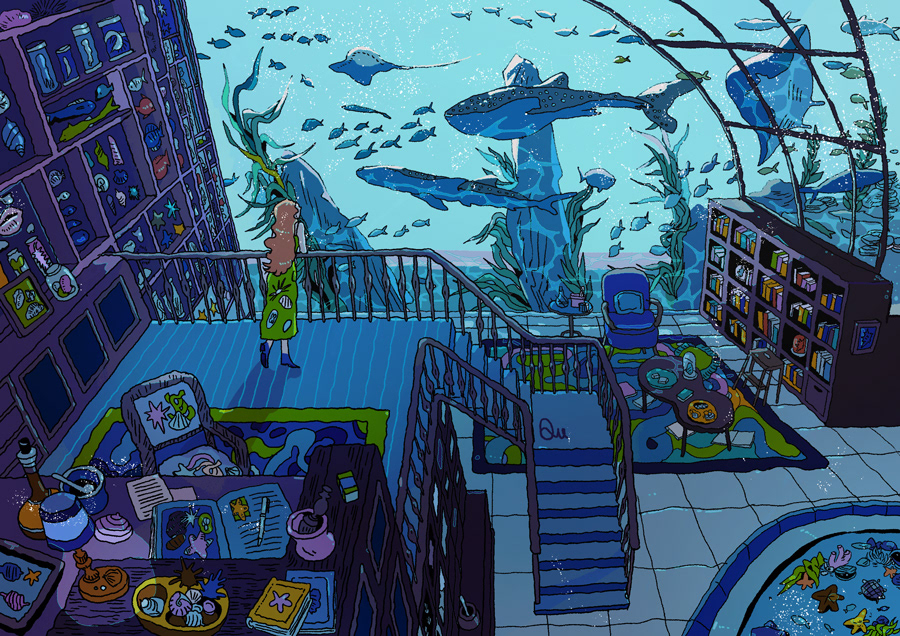
At what (x,y) coordinates should I click in order to perform the action: click on first set of stairs. Please return your answer as a coordinate pair (x, y). The width and height of the screenshot is (900, 636). Looking at the image, I should click on (572, 528).